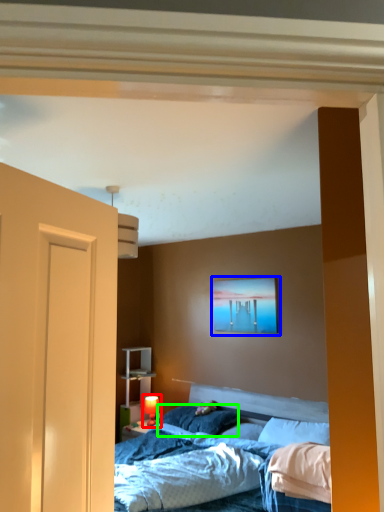
Question: Considering the real-world distances, which object is closest to table lamp (highlighted by a red box)? picture frame (highlighted by a blue box) or pillow (highlighted by a green box).

Choices:
 (A) picture frame
 (B) pillow

Answer: (B)